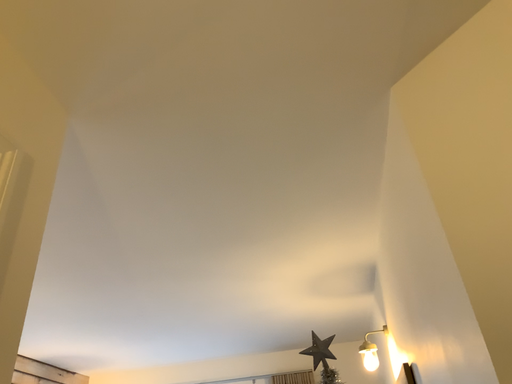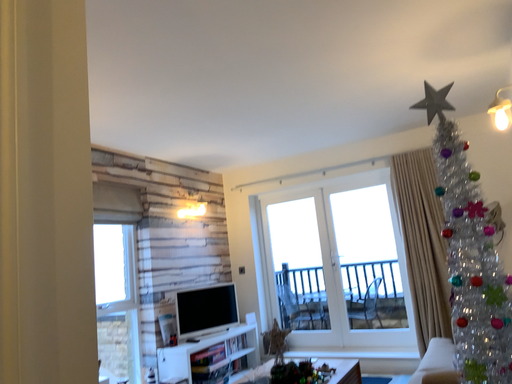
Question: How did the camera likely rotate when shooting the video?

Choices:
 (A) rotated left
 (B) rotated right

Answer: (A)